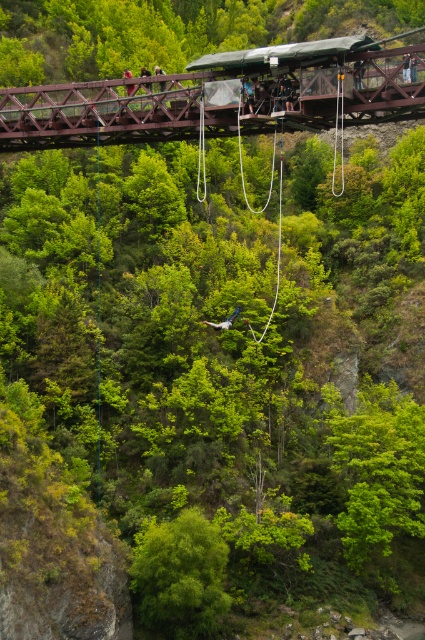
You are planning to cross the brown wooden bridge at upper center while carrying a large white fabric parachute at center. Given the bridge width, will you be able to walk across safely?

The brown wooden bridge at upper center is wider than the white fabric parachute at center, so you can walk across safely.

You are a safety inspector assessing the bungee jumping setup. You notice the brown wooden bridge at upper center and the white fabric parachute at center. Which object is positioned higher in the image?

The brown wooden bridge at upper center is much taller than the white fabric parachute at center, so it is positioned higher in the image.